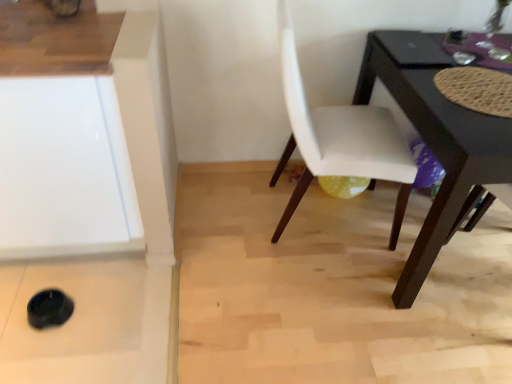
Question: Looking at the image, does glossy black table at lower right seem bigger or smaller compared to white leather chair at center?

Choices:
 (A) big
 (B) small

Answer: (A)

Question: Is glossy black table at lower right to the left or to the right of white leather chair at center in the image?

Choices:
 (A) right
 (B) left

Answer: (A)

Question: Estimate the real-world distances between objects in this image. Which object is closer to the glossy black table at lower right?

Choices:
 (A) white leather chair at center
 (B) white glossy cabinet at lower left

Answer: (A)

Question: Considering the real-world distances, which object is farthest from the white glossy cabinet at lower left?

Choices:
 (A) white leather chair at center
 (B) glossy black table at lower right

Answer: (B)